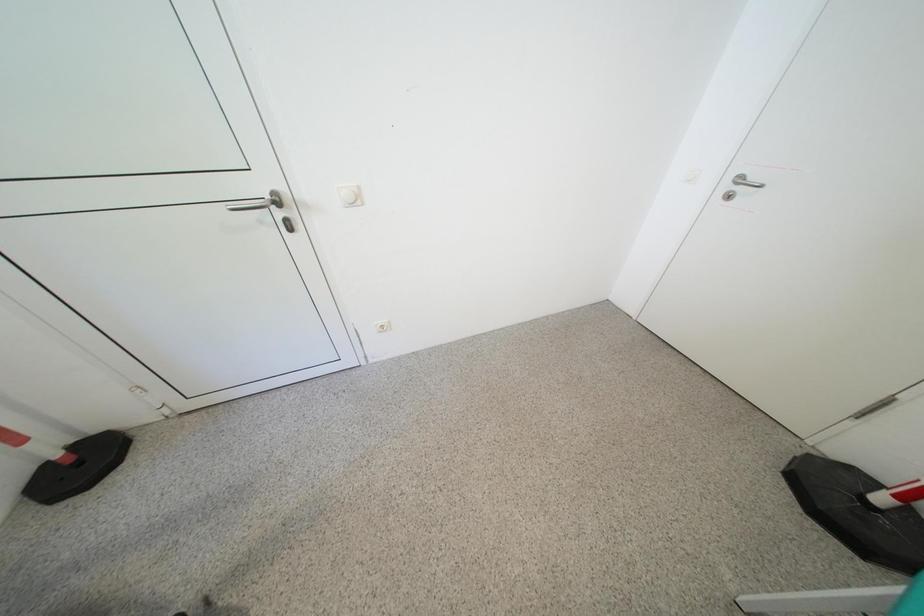
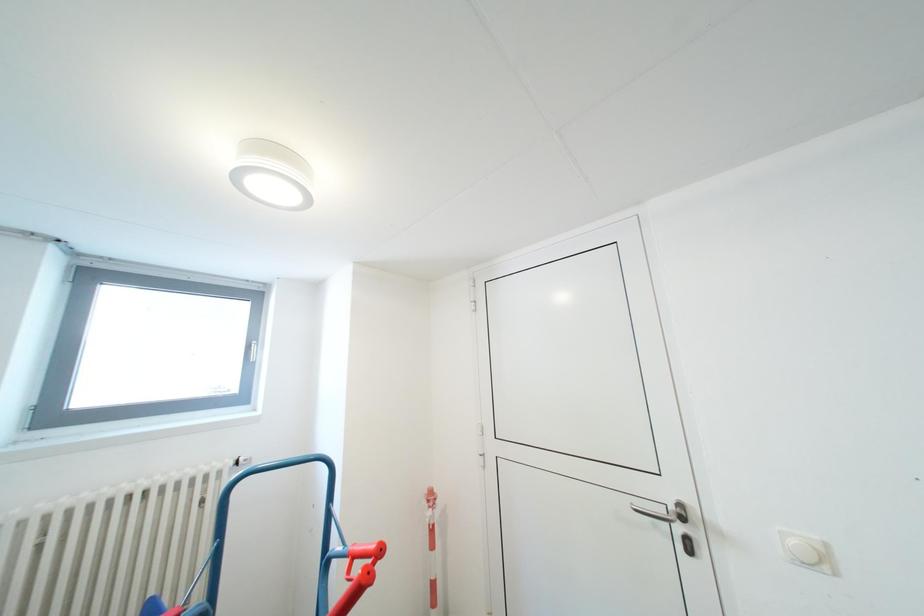
First-person continuous shooting, in which direction is the camera rotating?

The camera's rotation is toward left-up.